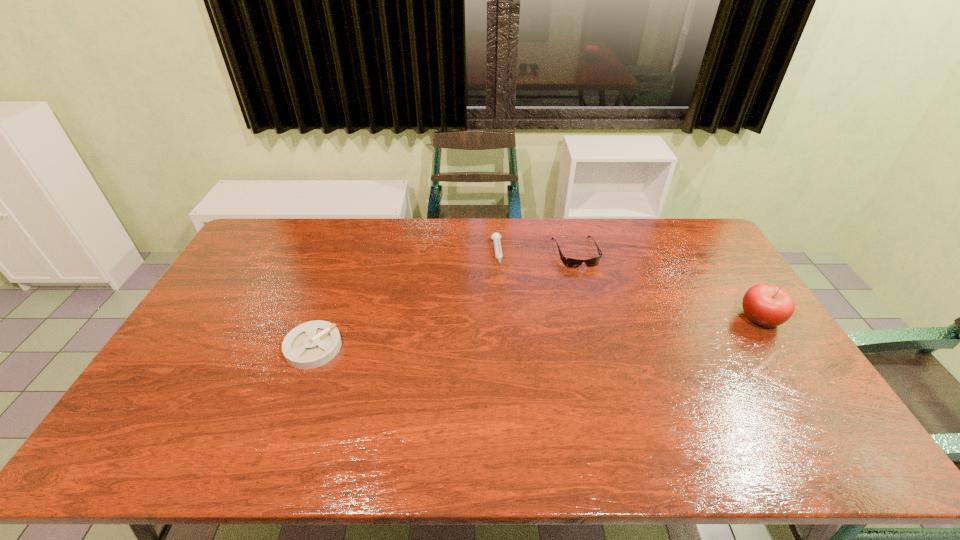
Where is `vacant point located at the needle end of the shortest object`? The image size is (960, 540). vacant point located at the needle end of the shortest object is located at coordinates (506, 331).

Image resolution: width=960 pixels, height=540 pixels. I want to click on vacant space located 0.110m on the front-facing side of the sunglasses, so click(591, 291).

The width and height of the screenshot is (960, 540). I want to click on vacant space located 0.270m on the front-facing side of the sunglasses, so click(x=606, y=326).

This screenshot has height=540, width=960. Identify the location of free space located on the front-facing side of the sunglasses. (587, 280).

Image resolution: width=960 pixels, height=540 pixels. I want to click on syringe that is at the far edge, so click(x=496, y=237).

Find the location of a particular element. This screenshot has height=540, width=960. sunglasses at the far edge is located at coordinates (568, 262).

Where is `object located at the right edge`? The height and width of the screenshot is (540, 960). object located at the right edge is located at coordinates [x=767, y=305].

In the image, there is a desktop. What are the coordinates of `vacant space at the far edge` in the screenshot? It's located at (444, 242).

Find the location of a particular element. Image resolution: width=960 pixels, height=540 pixels. free spot at the near edge of the desktop is located at coordinates (423, 407).

This screenshot has width=960, height=540. In order to click on free region at the left edge of the desktop in this screenshot , I will do `click(233, 267)`.